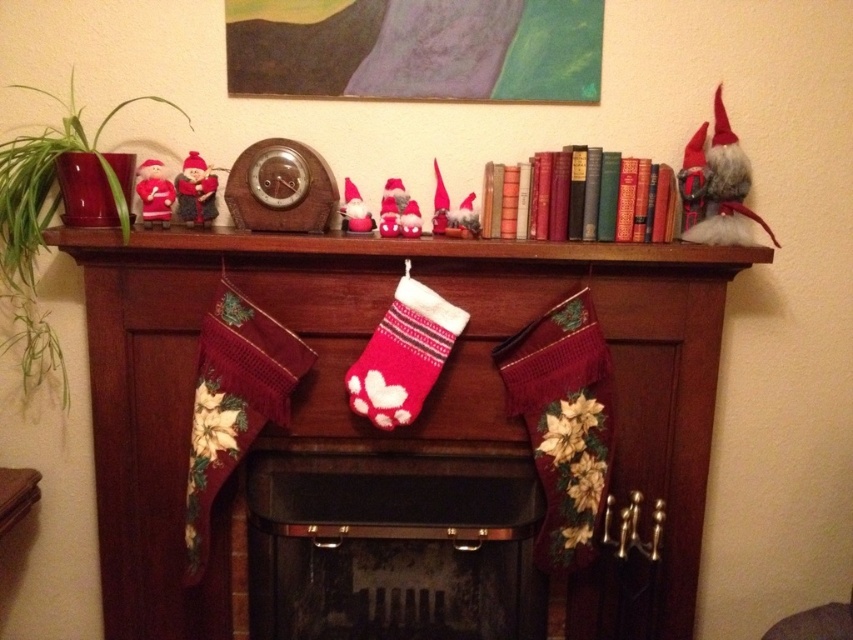
Question: Considering the relative positions of black metal fireplace at center and pink knitted sock at center in the image provided, where is black metal fireplace at center located with respect to pink knitted sock at center?

Choices:
 (A) above
 (B) below

Answer: (B)

Question: Which object is farther from the camera taking this photo?

Choices:
 (A) matte purple painting at upper center
 (B) pink knitted sock at center
 (C) black metal fireplace at center

Answer: (C)

Question: From the image, what is the correct spatial relationship of knitted stockings at center in relation to pink knitted sock at center?

Choices:
 (A) above
 (B) below

Answer: (B)

Question: Which is farther from the knitted stockings at center?

Choices:
 (A) pink knitted sock at center
 (B) knitted wool stockings at center

Answer: (B)

Question: Which point is closer to the camera taking this photo?

Choices:
 (A) (480, 250)
 (B) (526, 522)
 (C) (366, 97)
 (D) (358, 401)

Answer: (A)

Question: Observing the image, what is the correct spatial positioning of matte purple painting at upper center in reference to pink knitted sock at center?

Choices:
 (A) above
 (B) below

Answer: (A)